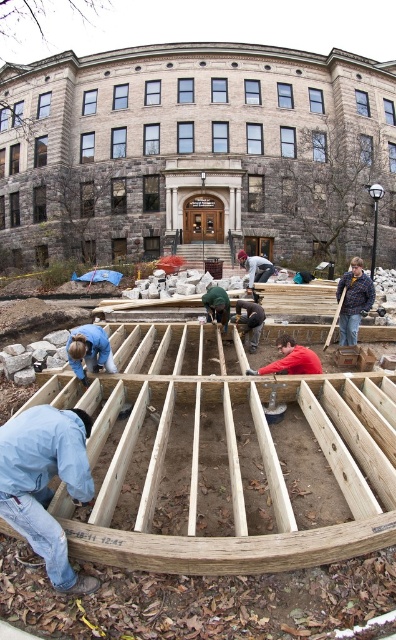
Question: Based on their relative distances, which object is farther from the wooden frame at center?

Choices:
 (A) light blue denim jacket at lower left
 (B) natural wood frame at center

Answer: (B)

Question: Can you confirm if natural wood frame at center is positioned to the left of light blue denim jacket at lower left?

Choices:
 (A) yes
 (B) no

Answer: (B)

Question: Which point is farther to the camera?

Choices:
 (A) (123, 324)
 (B) (41, 472)
 (C) (277, 148)

Answer: (C)

Question: Does wooden frame at center appear on the right side of light blue denim jacket at lower left?

Choices:
 (A) yes
 (B) no

Answer: (A)

Question: Which object is farther from the camera taking this photo?

Choices:
 (A) natural wood frame at center
 (B) wooden frame at center
 (C) light blue denim jacket at lower left

Answer: (B)

Question: Can you confirm if wooden frame at center is bigger than natural wood frame at center?

Choices:
 (A) no
 (B) yes

Answer: (B)